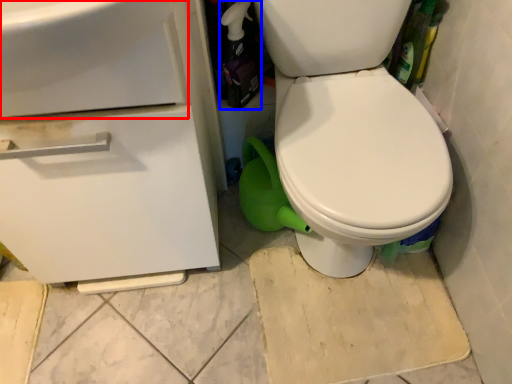
Question: Among these objects, which one is nearest to the camera, sink (highlighted by a red box) or bottle (highlighted by a blue box)?

Choices:
 (A) sink
 (B) bottle

Answer: (A)